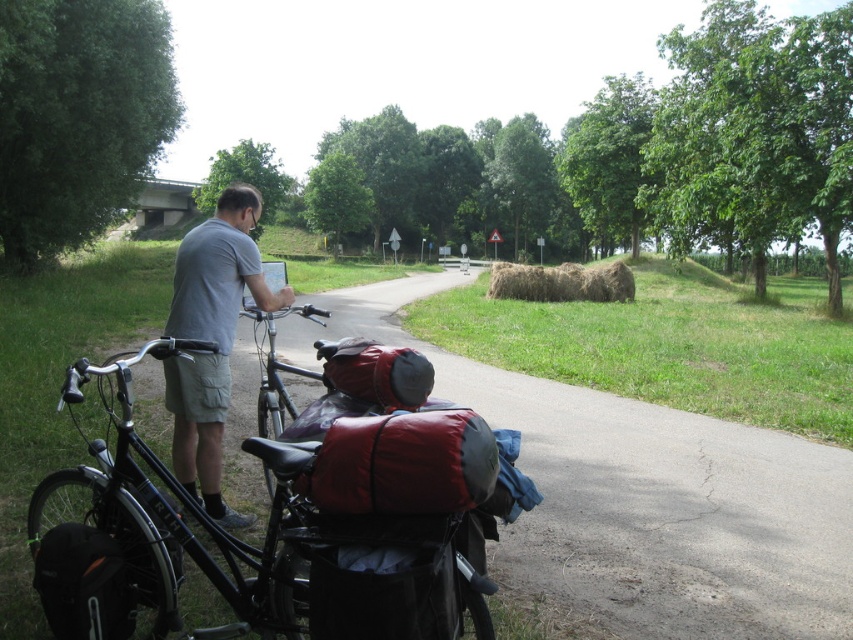
You are a cyclist planning to load your gear onto the black matte bicycle at left and the gray cotton shirt at left. Which item requires more space due to its width?

The black matte bicycle at left is wider than the gray cotton shirt at left, so it requires more space.

You are a cyclist who just arrived at a rural road and see a gray cotton shirt at left and a brown straw bale at center. Which object is closer to your left side?

The gray cotton shirt at left is closer to your left side because it is positioned on the left side of the brown straw bale at center.

You are a cyclist planning to ride from the starting point to the destination. You see a point marked at coordinates (271, 529). What object is located at this point?

The point at coordinates (271, 529) marks the black matte bicycle at left.